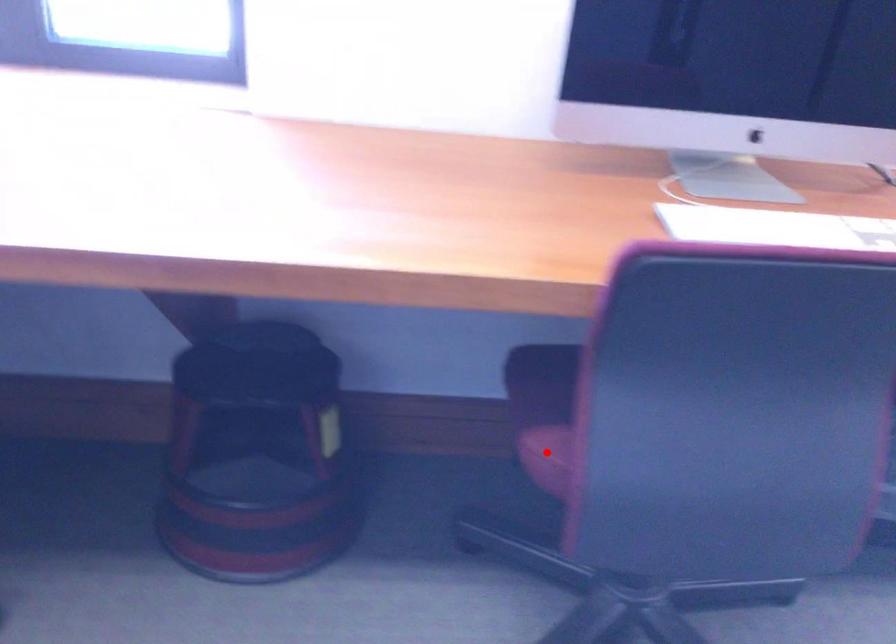
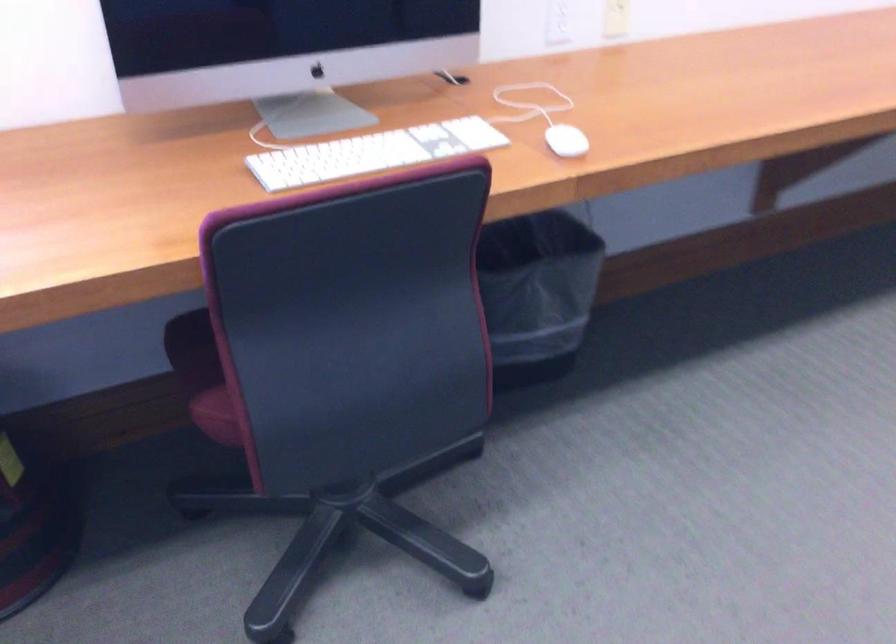
Locate, in the second image, the point that corresponds to the highlighted location in the first image.

(220, 413)